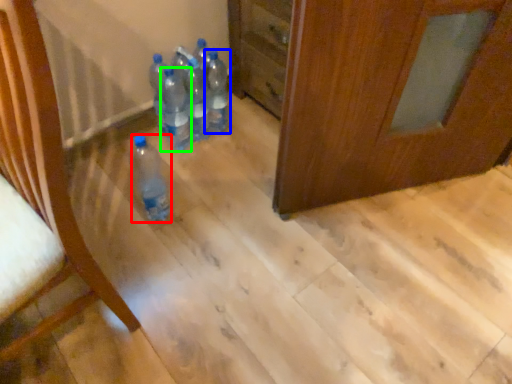
Question: Considering the real-world distances, which object is farthest from bottle (highlighted by a red box)? bottle (highlighted by a blue box) or bottle (highlighted by a green box)?

Choices:
 (A) bottle
 (B) bottle

Answer: (A)